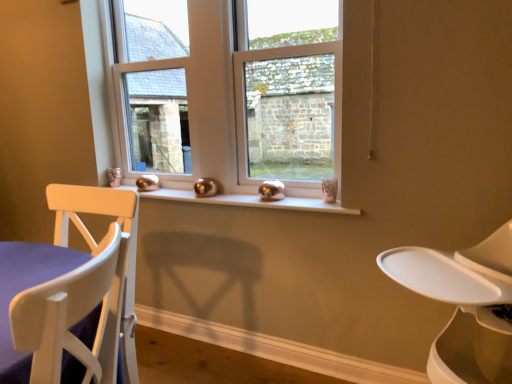
You are a GUI agent. You are given a task and a screenshot of the screen. Output one action in this format:
    pyautogui.click(x=<x>, y=<y>)
    Task: Click on the vacant space situated above white glossy window sill at center (from a real-world perspective)
    The image size is (512, 384).
    Given the screenshot: What is the action you would take?
    pyautogui.click(x=203, y=197)